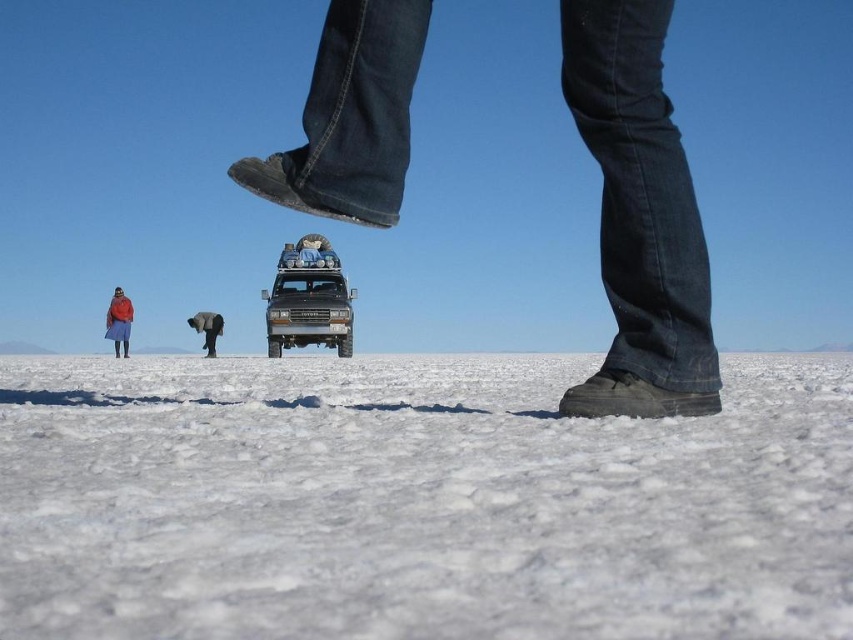
Is denim jeans at upper center shorter than red wool sweater at lower left?

Yes.

Does denim jeans at upper center appear on the right side of red wool sweater at lower left?

Yes, denim jeans at upper center is to the right of red wool sweater at lower left.

Does point (567, 413) come in front of point (117, 340)?

Yes, it is in front of point (117, 340).

Identify the location of denim jeans at upper center. (639, 216).

Is point (344, 380) positioned after point (193, 316)?

No, (344, 380) is in front of (193, 316).

Looking at this image, can you confirm if white crystalline snow at lower center is thinner than smooth gray elephant at center?

No.

Between point (106, 541) and point (216, 330), which one is positioned in front?

Point (106, 541) is in front.

Identify the location of white crystalline snow at lower center. The width and height of the screenshot is (853, 640). (416, 500).

Between white crystalline snow at lower center and denim jeans at upper center, which one is positioned higher?

Positioned higher is denim jeans at upper center.

Which is below, white crystalline snow at lower center or denim jeans at upper center?

white crystalline snow at lower center

Image resolution: width=853 pixels, height=640 pixels. Describe the element at coordinates (416, 500) in the screenshot. I see `white crystalline snow at lower center` at that location.

Where is `white crystalline snow at lower center`? This screenshot has width=853, height=640. white crystalline snow at lower center is located at coordinates (416, 500).